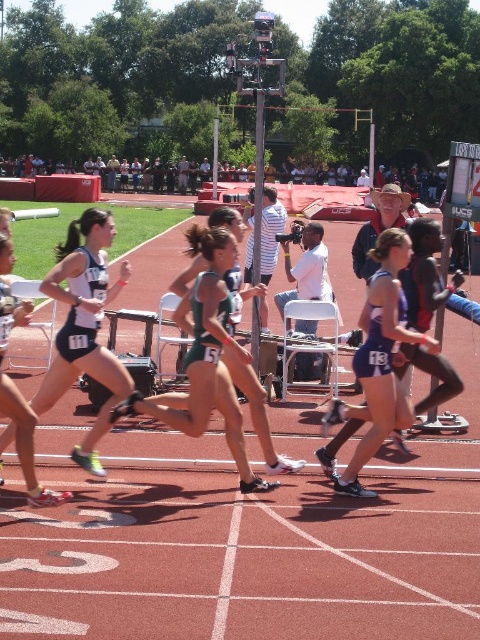
Question: Among these points, which one is nearest to the camera?

Choices:
 (A) (282, 481)
 (B) (374, 404)

Answer: (B)

Question: Where is matte black shorts at center located in relation to green athletic uniform at center in the image?

Choices:
 (A) below
 (B) above

Answer: (A)

Question: Does red rubber track at center appear on the right side of green athletic uniform at center?

Choices:
 (A) yes
 (B) no

Answer: (A)

Question: Is matte black shorts at center thinner than blue athletic uniform at center?

Choices:
 (A) no
 (B) yes

Answer: (B)

Question: Which of the following is the closest to the observer?

Choices:
 (A) blue athletic uniform at center
 (B) matte black shorts at center
 (C) red rubber track at center

Answer: (C)

Question: Considering the real-world distances, which object is farthest from the blue athletic uniform at center?

Choices:
 (A) matte black shorts at center
 (B) green athletic uniform at center
 (C) red rubber track at center

Answer: (A)